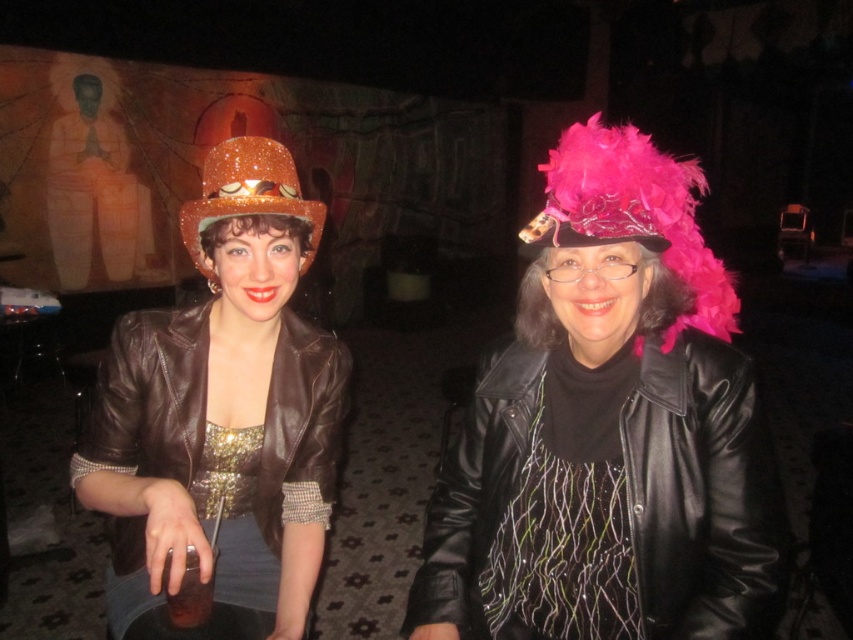
Question: Is black sequined dress at center smaller than matte gold statue at upper left?

Choices:
 (A) no
 (B) yes

Answer: (B)

Question: Which point is closer to the camera taking this photo?

Choices:
 (A) (518, 337)
 (B) (660, 456)
 (C) (111, 248)

Answer: (B)

Question: Among these objects, which one is farthest from the camera?

Choices:
 (A) pink feathered wig at center
 (B) black leather jacket at center

Answer: (A)

Question: Is matte brown leather jacket at left smaller than black sequined dress at center?

Choices:
 (A) yes
 (B) no

Answer: (B)

Question: Is black leather jacket at center above shiny orange hat at left?

Choices:
 (A) yes
 (B) no

Answer: (B)

Question: Among these objects, which one is farthest from the camera?

Choices:
 (A) sparkly orange cowboy hat at left
 (B) black sequined dress at center
 (C) matte brown leather jacket at left
 (D) shiny brown leather jacket at left

Answer: (A)